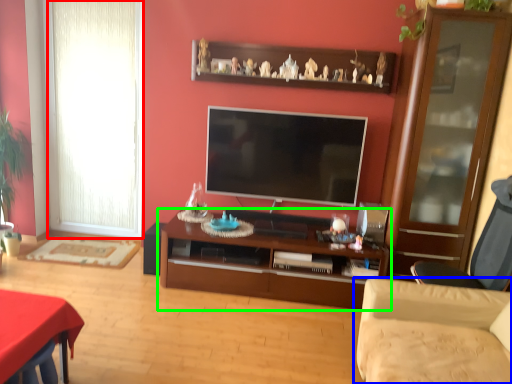
Question: Which is nearer to the window (highlighted by a red box)? studio couch (highlighted by a blue box) or cabinetry (highlighted by a green box).

Choices:
 (A) studio couch
 (B) cabinetry

Answer: (B)